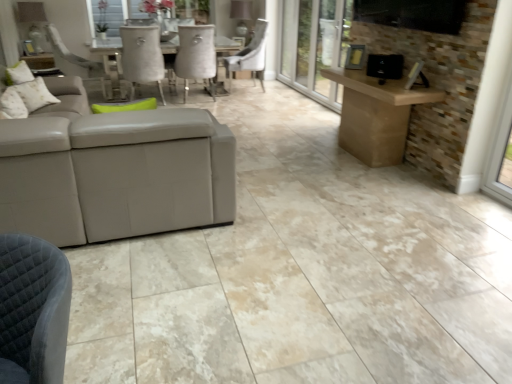
Describe the element at coordinates (13, 105) in the screenshot. The width and height of the screenshot is (512, 384). I see `fluffy white pillow at upper left, arranged as the first pillow when viewed from the right` at that location.

Image resolution: width=512 pixels, height=384 pixels. Describe the element at coordinates (196, 56) in the screenshot. I see `suede-like beige chair at center, which is the first chair from left to right` at that location.

Find the location of a particular element. This screenshot has width=512, height=384. white fabric pillow at upper left, which is the second pillow in front-to-back order is located at coordinates (26, 98).

The height and width of the screenshot is (384, 512). Identify the location of fluffy white pillow at upper left, acting as the 1th pillow starting from the front. (x=13, y=105).

Can you tell me how much white leather chair at center, which appears as the 1th chair when viewed from the right, and white fabric pillow at upper left, which is the 2th pillow from right to left, differ in facing direction?

The angle between the facing direction of white leather chair at center, which appears as the 1th chair when viewed from the right, and the facing direction of white fabric pillow at upper left, which is the 2th pillow from right to left, is 176 degrees.

From a real-world perspective, who is located lower, white leather chair at center, which appears as the 1th chair when viewed from the right, or white fabric pillow at upper left, which is the 2th pillow from right to left?

white leather chair at center, which appears as the 1th chair when viewed from the right, is physically lower.

Is the position of white leather chair at center, which is the 2th chair in left-to-right order, more distant than that of white fabric pillow at upper left, which ranks as the 1th pillow in back-to-front order?

Yes, it is.

Which point is more forward, (234,70) or (16,112)?

Positioned in front is point (16,112).

Relative to white fabric pillow at upper left, which is the 2th pillow from right to left, is fluffy white pillow at upper left, the second pillow when ordered from left to right, in front or behind?

Visually, fluffy white pillow at upper left, the second pillow when ordered from left to right, is located in front of white fabric pillow at upper left, which is the 2th pillow from right to left.

Is fluffy white pillow at upper left, the second pillow when ordered from left to right, oriented towards white fabric pillow at upper left, acting as the 1th pillow starting from the left?

No, fluffy white pillow at upper left, the second pillow when ordered from left to right, is not facing towards white fabric pillow at upper left, acting as the 1th pillow starting from the left.

Which object is thinner, fluffy white pillow at upper left, arranged as the first pillow when viewed from the right, or white fabric pillow at upper left, which is the 2th pillow from right to left?

Thinner between the two is fluffy white pillow at upper left, arranged as the first pillow when viewed from the right.

Is white fabric pillow at upper left, which is the second pillow in front-to-back order, bigger than white leather chair at center, which appears as the 1th chair when viewed from the right?

Actually, white fabric pillow at upper left, which is the second pillow in front-to-back order, might be smaller than white leather chair at center, which appears as the 1th chair when viewed from the right.

From the image's perspective, which is above, white fabric pillow at upper left, which ranks as the 1th pillow in back-to-front order, or white leather chair at center, which is the 2th chair in left-to-right order?

white leather chair at center, which is the 2th chair in left-to-right order, appears higher in the image.

Could you tell me if white fabric pillow at upper left, which ranks as the 1th pillow in back-to-front order, is turned towards white leather chair at center, which appears as the 1th chair when viewed from the right?

No, white fabric pillow at upper left, which ranks as the 1th pillow in back-to-front order, is not oriented towards white leather chair at center, which appears as the 1th chair when viewed from the right.

Are white fabric pillow at upper left, which is the 2th pillow from right to left, and white leather chair at center, which is the 2th chair in left-to-right order, making contact?

No, white fabric pillow at upper left, which is the 2th pillow from right to left, is not making contact with white leather chair at center, which is the 2th chair in left-to-right order.

From a real-world perspective, is white leather chair at center, which appears as the 1th chair when viewed from the right, positioned above or below fluffy white pillow at upper left, acting as the 1th pillow starting from the front?

In terms of real-world spatial position, white leather chair at center, which appears as the 1th chair when viewed from the right, is below fluffy white pillow at upper left, acting as the 1th pillow starting from the front.

Which is closer, [232,66] or [14,110]?

Point [232,66] is positioned farther from the camera compared to point [14,110].

From a real-world perspective, count 2nd pillows upward from the white leather chair at center, which is the 2th chair in left-to-right order, and point to it. Please provide its 2D coordinates.

[(13, 105)]

Between point (192, 42) and point (254, 45), which one is positioned behind?

The point (254, 45) is farther from the camera.

Which is more to the left, suede-like beige chair at center, the second chair when ordered from right to left, or white leather chair at center, which is the 2th chair in left-to-right order?

suede-like beige chair at center, the second chair when ordered from right to left, is more to the left.

Is suede-like beige chair at center, which is the first chair from left to right, facing away from white leather chair at center, which appears as the 1th chair when viewed from the right?

No.

Is suede-like beige chair at center, the second chair when ordered from right to left, wider or thinner than white leather chair at center, which is the 2th chair in left-to-right order?

Considering their sizes, suede-like beige chair at center, the second chair when ordered from right to left, looks slimmer than white leather chair at center, which is the 2th chair in left-to-right order.

From the image's perspective, would you say transparent glass screen door at center is positioned over white leather chair at center, which is the 2th chair in left-to-right order?

Yes.

Which of these two, transparent glass screen door at center or white leather chair at center, which is the 2th chair in left-to-right order, stands taller?

transparent glass screen door at center is taller.

Considering the sizes of objects transparent glass screen door at center and white leather chair at center, which appears as the 1th chair when viewed from the right, in the image provided, who is thinner, transparent glass screen door at center or white leather chair at center, which appears as the 1th chair when viewed from the right,?

transparent glass screen door at center.

Would you say transparent glass screen door at center is a long distance from white leather chair at center, which is the 2th chair in left-to-right order?

Absolutely, transparent glass screen door at center is distant from white leather chair at center, which is the 2th chair in left-to-right order.

Is suede-like beige chair at center, the second chair when ordered from right to left, surrounded by transparent glass screen door at center?

No, suede-like beige chair at center, the second chair when ordered from right to left, is not inside transparent glass screen door at center.

From a real-world perspective, is transparent glass screen door at center above or below suede-like beige chair at center, the second chair when ordered from right to left?

transparent glass screen door at center is situated higher than suede-like beige chair at center, the second chair when ordered from right to left, in the real world.

Is point (346, 25) closer to camera compared to point (194, 70)?

That is True.

The width and height of the screenshot is (512, 384). What are the coordinates of `chair that is the 2nd one when counting rightward from the white fabric pillow at upper left, which ranks as the 1th pillow in back-to-front order` in the screenshot? It's located at (249, 56).

Image resolution: width=512 pixels, height=384 pixels. I want to click on pillow located above the fluffy white pillow at upper left, the second pillow when ordered from left to right (from the image's perspective), so click(x=26, y=98).

In the scene shown: Estimate the real-world distances between objects in this image. Which object is further from white fabric pillow at upper left, which is the second pillow in front-to-back order, fluffy white pillow at upper left, the second pillow when ordered from left to right, or white leather chair at center, which is the 2th chair in left-to-right order?

white leather chair at center, which is the 2th chair in left-to-right order.

Which object lies further to the anchor point transparent glass screen door at center, fluffy white pillow at upper left, acting as the 1th pillow starting from the front, or white fabric pillow at upper left, which ranks as the 1th pillow in back-to-front order?

fluffy white pillow at upper left, acting as the 1th pillow starting from the front, is positioned further to the anchor transparent glass screen door at center.

From the image, which object appears to be nearer to white fabric pillow at upper left, which is the 2th pillow from right to left, white leather chair at center, which is the 2th chair in left-to-right order, or transparent glass screen door at center?

Among the two, transparent glass screen door at center is located nearer to white fabric pillow at upper left, which is the 2th pillow from right to left.

Based on their spatial positions, is white fabric pillow at upper left, acting as the 1th pillow starting from the left, or white leather chair at center, which is the 2th chair in left-to-right order, closer to transparent glass screen door at center?

Based on the image, white leather chair at center, which is the 2th chair in left-to-right order, appears to be nearer to transparent glass screen door at center.

Estimate the real-world distances between objects in this image. Which object is closer to white leather chair at center, which appears as the 1th chair when viewed from the right, fluffy white pillow at upper left, the second pillow when ordered from left to right, or transparent glass screen door at center?

Based on the image, transparent glass screen door at center appears to be nearer to white leather chair at center, which appears as the 1th chair when viewed from the right.

Based on their spatial positions, is suede-like beige chair at center, which is the first chair from left to right, or white fabric pillow at upper left, which is the second pillow in front-to-back order, closer to transparent glass screen door at center?

Based on the image, suede-like beige chair at center, which is the first chair from left to right, appears to be nearer to transparent glass screen door at center.

Looking at this image, from the image, which object appears to be farther from white fabric pillow at upper left, which is the 2th pillow from right to left, suede-like beige chair at center, which is the first chair from left to right, or white leather chair at center, which appears as the 1th chair when viewed from the right?

The object further to white fabric pillow at upper left, which is the 2th pillow from right to left, is white leather chair at center, which appears as the 1th chair when viewed from the right.

When comparing their distances from transparent glass screen door at center, does white leather chair at center, which is the 2th chair in left-to-right order, or white fabric pillow at upper left, acting as the 1th pillow starting from the left, seem closer?

white leather chair at center, which is the 2th chair in left-to-right order.

Identify the location of chair positioned between fluffy white pillow at upper left, the 2th pillow from the back, and white leather chair at center, which is the 2th chair in left-to-right order, from near to far. This screenshot has height=384, width=512. (196, 56).

This screenshot has width=512, height=384. I want to click on pillow located between fluffy white pillow at upper left, the 2th pillow from the back, and white leather chair at center, which appears as the 1th chair when viewed from the right, in the depth direction, so pyautogui.click(x=26, y=98).

The image size is (512, 384). What are the coordinates of `pillow positioned between fluffy white pillow at upper left, the second pillow when ordered from left to right, and suede-like beige chair at center, the second chair when ordered from right to left, from near to far` in the screenshot? It's located at (26, 98).

You are a GUI agent. You are given a task and a screenshot of the screen. Output one action in this format:
    pyautogui.click(x=<x>, y=<y>)
    Task: Click on the pillow located between white fabric pillow at upper left, which ranks as the 1th pillow in back-to-front order, and transparent glass screen door at center in the left-right direction
    The image size is (512, 384).
    Given the screenshot: What is the action you would take?
    pyautogui.click(x=13, y=105)